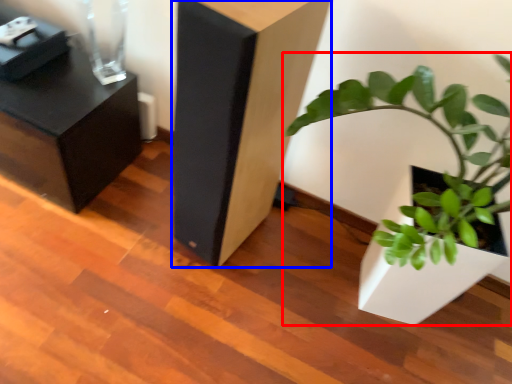
Question: Which object appears farthest to the camera in this image, houseplant (highlighted by a red box) or furniture (highlighted by a blue box)?

Choices:
 (A) houseplant
 (B) furniture

Answer: (B)